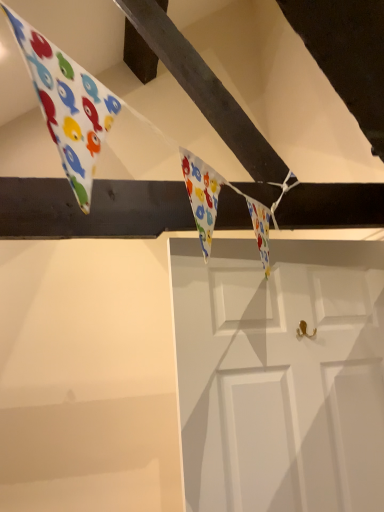
Find the location of a particular element. The image size is (384, 512). white matte door at center is located at coordinates (280, 375).

Describe the element at coordinates (280, 375) in the screenshot. The height and width of the screenshot is (512, 384). I see `white matte door at center` at that location.

Find the location of `white matte door at center`. white matte door at center is located at coordinates (280, 375).